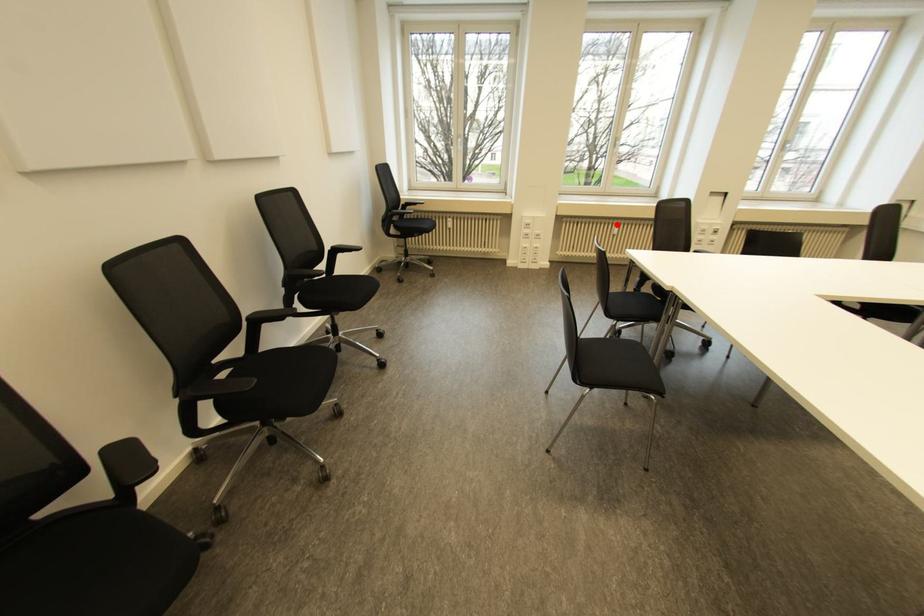
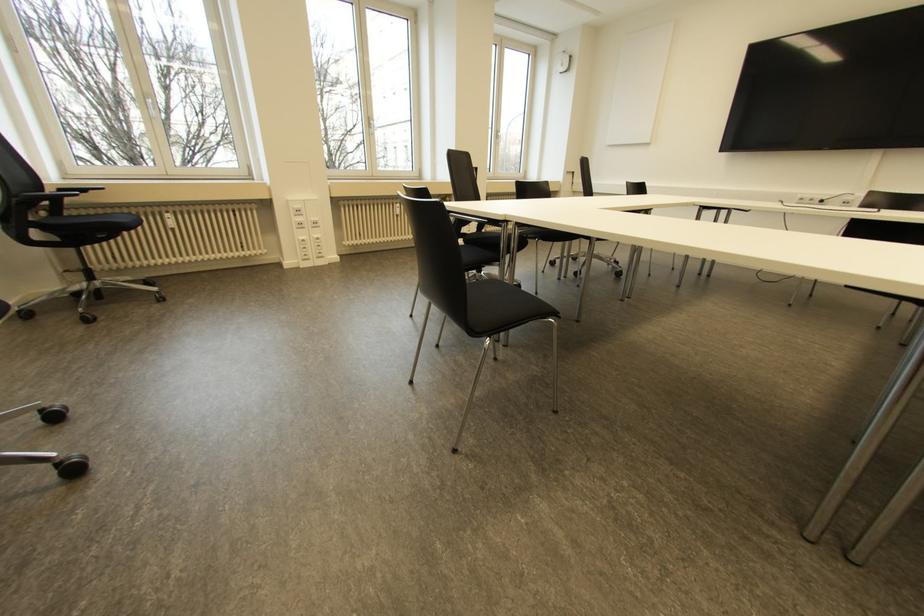
Question: I am providing you with two images of the same scene from different viewpoints. A red point is shown in image1. For the corresponding object point in image2, is it positioned nearer or farther from the camera?

Choices:
 (A) Nearer
 (B) Farther

Answer: (A)